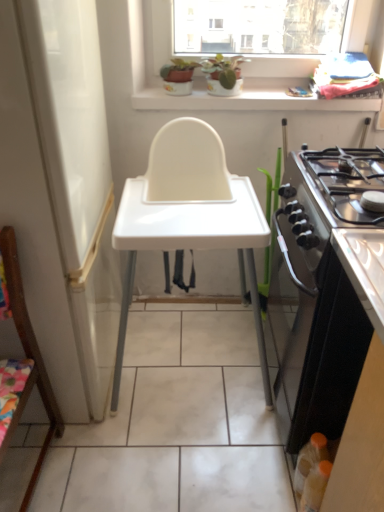
This screenshot has height=512, width=384. Find the location of `blank space situated above white glossy window sill at upper center (from a real-world perspective)`. blank space situated above white glossy window sill at upper center (from a real-world perspective) is located at coordinates (261, 90).